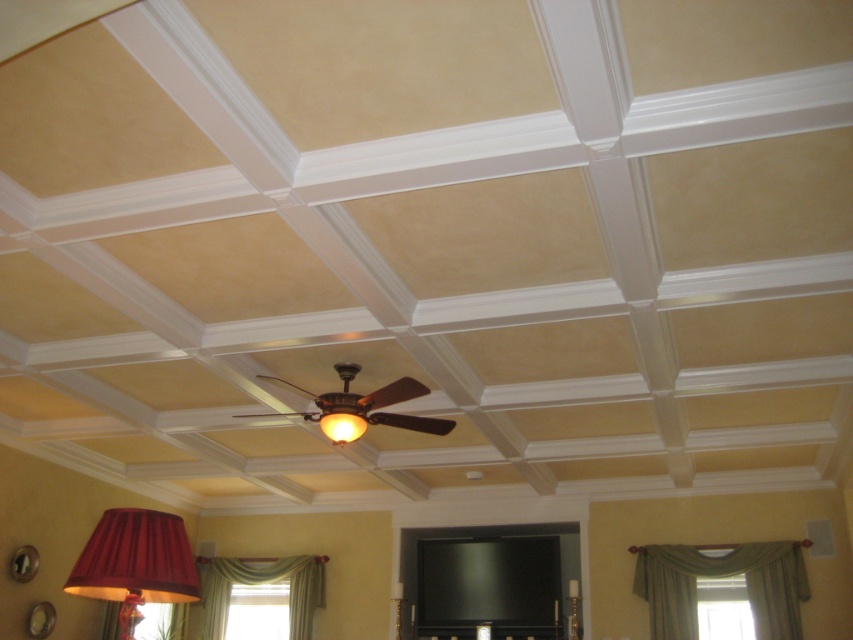
You are standing in the room and want to hang a new painting above the green fabric curtain at lower right. Since the wooden ceiling fan at center is directly above the curtain, will the fan interfere with hanging the painting?

The green fabric curtain at lower right is below the wooden ceiling fan at center, so the fan is directly above the curtain. Hanging a painting there would interfere with the fan, making it impossible to place the painting without obstruction.

You are standing in the room and want to hang a new picture frame between the green fabric curtain at lower right and the matte gold lampshade at center. Based on their positions, where should you place the frame so it is between them?

The green fabric curtain at lower right is located below the matte gold lampshade at center, so placing the picture frame between them would require positioning it above the curtain and below the lampshade.

You are standing in the room and want to hang a large painting that requires a taller hanging space. Which green fabric curtain should you choose between the green fabric curtain at lower right and the green fabric curtain at lower left?

The green fabric curtain at lower right is much taller than the green fabric curtain at lower left, so you should choose the green fabric curtain at lower right for hanging the large painting that requires a taller hanging space.